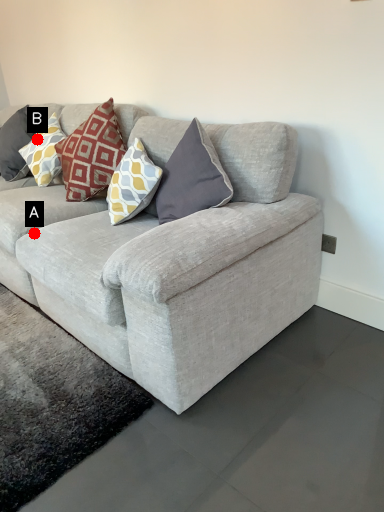
Question: Two points are circled on the image, labeled by A and B beside each circle. Which point is closer to the camera taking this photo?

Choices:
 (A) A is closer
 (B) B is closer

Answer: (A)